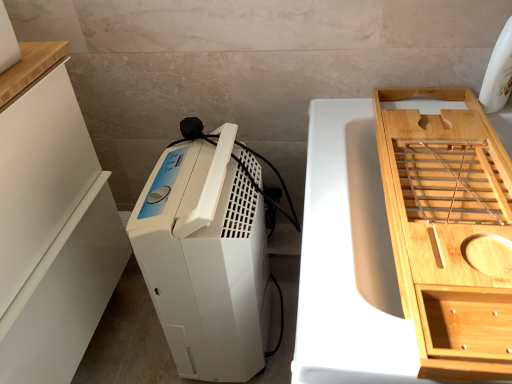
Question: Looking at the image, does light wood/texture bamboo tray at right, the first cabinetry from the right, seem bigger or smaller compared to white plastic dehumidifier at center?

Choices:
 (A) big
 (B) small

Answer: (B)

Question: In terms of width, does light wood/texture bamboo tray at right, the first cabinetry from the right, look wider or thinner when compared to white plastic dehumidifier at center?

Choices:
 (A) wide
 (B) thin

Answer: (B)

Question: Based on their relative distances, which object is nearer to the bamboo tray at right?

Choices:
 (A) white plastic dehumidifier at center
 (B) light wood/texture bamboo tray at right, the first cabinetry from the right
 (C) white matte cabinet at left, which is counted as the second cabinetry, starting from the right

Answer: (B)

Question: Estimate the real-world distances between objects in this image. Which object is closer to the bamboo tray at right?

Choices:
 (A) white plastic dehumidifier at center
 (B) light wood/texture bamboo tray at right, which ranks as the 2th cabinetry in left-to-right order
 (C) white matte cabinet at left, acting as the 1th cabinetry starting from the left

Answer: (B)